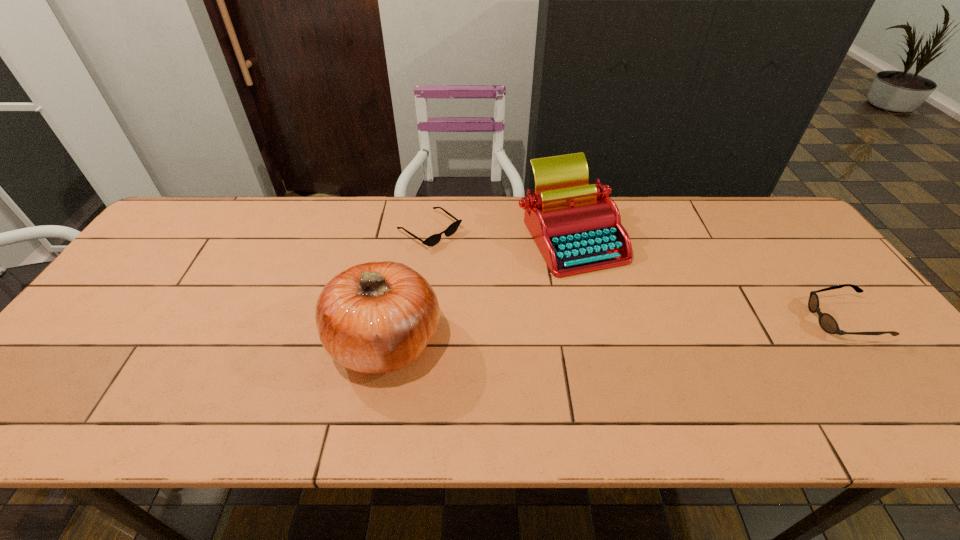
In order to click on vacant space situated on the lenses of the rightmost object in this screenshot , I will do `click(777, 320)`.

Where is `blank space located 0.360m on the typing side of the third object from left to right`? blank space located 0.360m on the typing side of the third object from left to right is located at coordinates (548, 389).

What are the coordinates of `free point located 0.290m on the typing side of the third object from left to right` in the screenshot? It's located at (552, 363).

At what (x,y) coordinates should I click in order to perform the action: click on vacant position located on the typing side of the third object from left to right. Please return your answer as a coordinate pair (x, y). This screenshot has height=540, width=960. Looking at the image, I should click on (563, 301).

You are a GUI agent. You are given a task and a screenshot of the screen. Output one action in this format:
    pyautogui.click(x=<x>, y=<y>)
    Task: Click on the blank space located on the front-facing side of the shorter sunglasses
    The width and height of the screenshot is (960, 540).
    Given the screenshot: What is the action you would take?
    pyautogui.click(x=475, y=262)

You are a GUI agent. You are given a task and a screenshot of the screen. Output one action in this format:
    pyautogui.click(x=<x>, y=<y>)
    Task: Click on the free space located on the front-facing side of the shorter sunglasses
    This screenshot has width=960, height=540.
    Given the screenshot: What is the action you would take?
    pyautogui.click(x=503, y=281)

The width and height of the screenshot is (960, 540). In order to click on free space located on the front-facing side of the shorter sunglasses in this screenshot , I will do `click(515, 289)`.

What are the coordinates of `typewriter that is at the far edge` in the screenshot? It's located at (577, 228).

Where is `sunglasses that is positioned at the far edge`? sunglasses that is positioned at the far edge is located at coordinates (434, 239).

Locate an element on the screen. This screenshot has width=960, height=540. object that is at the near edge is located at coordinates (376, 317).